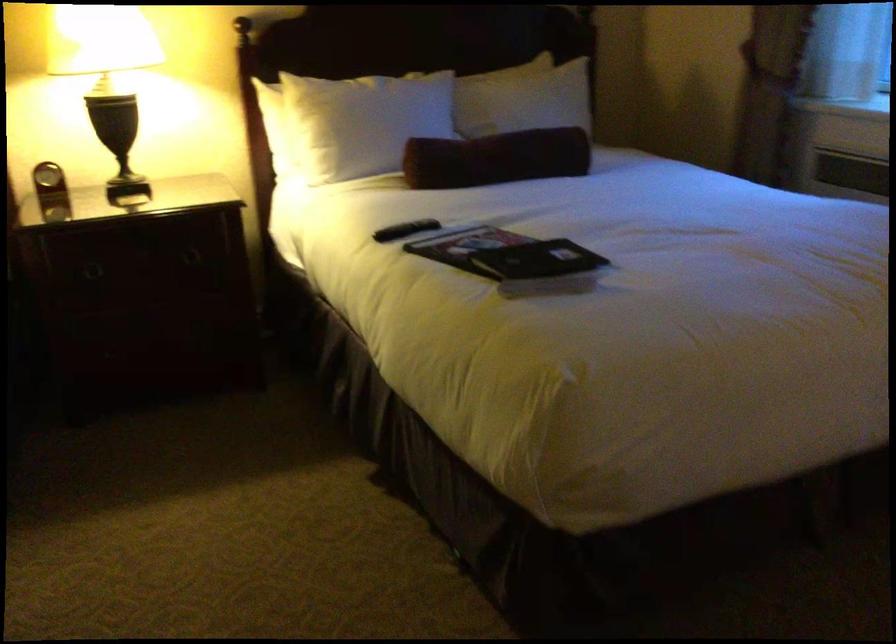
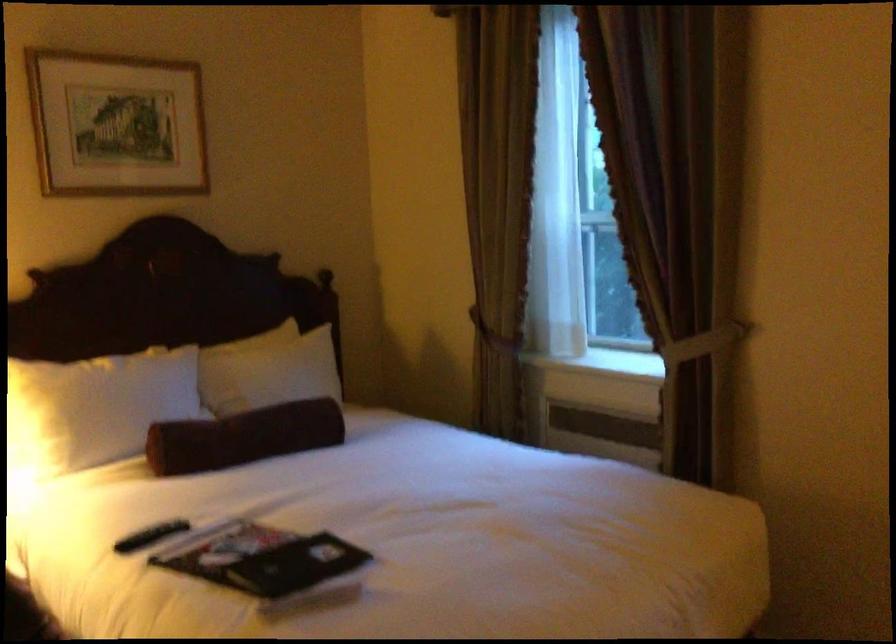
The point at (489, 156) is marked in the first image. Where is the corresponding point in the second image?

(243, 437)